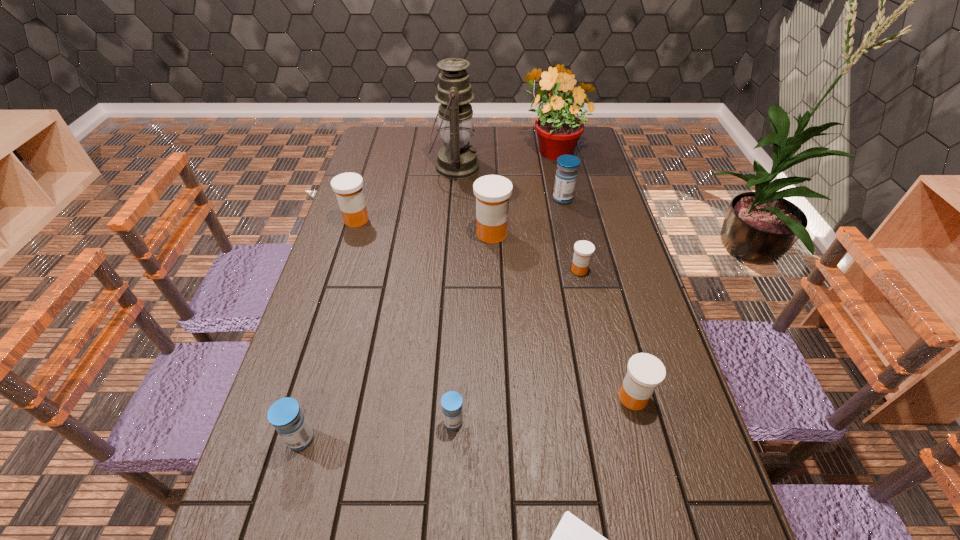
Where is `vacant space located on the back of the biggest blue medicine`? Image resolution: width=960 pixels, height=540 pixels. vacant space located on the back of the biggest blue medicine is located at coordinates [558, 175].

You are a GUI agent. You are given a task and a screenshot of the screen. Output one action in this format:
    pyautogui.click(x=<x>, y=<y>)
    Task: Click on the blank area located 0.190m on the label of the nearest orange medicine
    This screenshot has height=540, width=960.
    Given the screenshot: What is the action you would take?
    pyautogui.click(x=661, y=506)

Locate an element on the screen. Image resolution: width=960 pixels, height=540 pixels. vacant space located 0.270m on the back of the second smallest blue medicine is located at coordinates (333, 326).

Find the location of a particular element. This screenshot has width=960, height=540. vacant space positioned 0.320m on the label of the fourth farthest medicine is located at coordinates (603, 374).

Where is `vacant area located on the back of the fifth medicine from right to left`? The image size is (960, 540). vacant area located on the back of the fifth medicine from right to left is located at coordinates (457, 345).

Locate an element on the screen. Image resolution: width=960 pixels, height=540 pixels. oil lamp positioned at the far edge is located at coordinates (456, 160).

Where is `flowerpot present at the far edge`? flowerpot present at the far edge is located at coordinates [558, 129].

Identify the location of flowerpot present at the right edge. (558, 129).

Identify the location of object present at the far right corner. The height and width of the screenshot is (540, 960). (558, 129).

At what (x,y) coordinates should I click in order to perform the action: click on free space at the far edge. Please return your answer as a coordinate pair (x, y). Looking at the image, I should click on (432, 138).